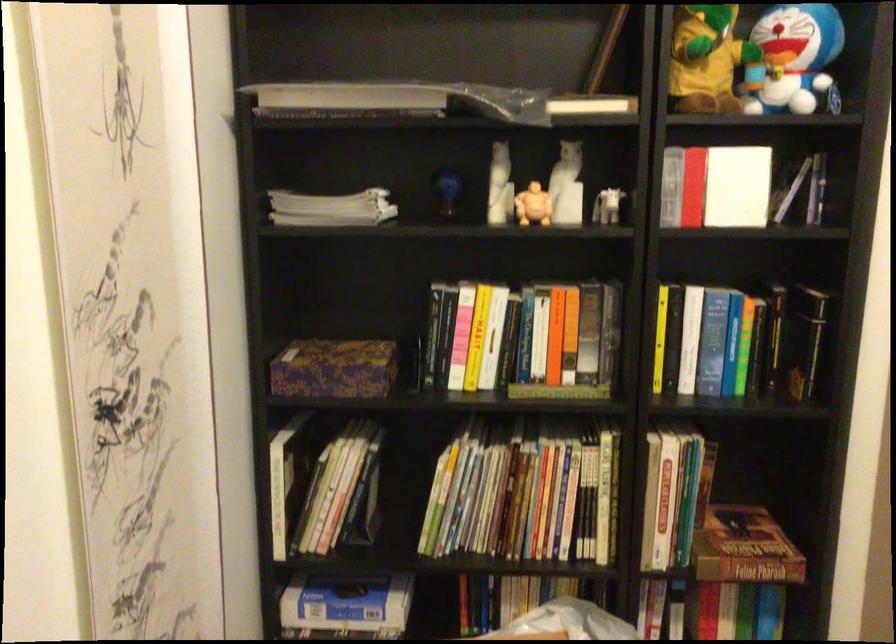
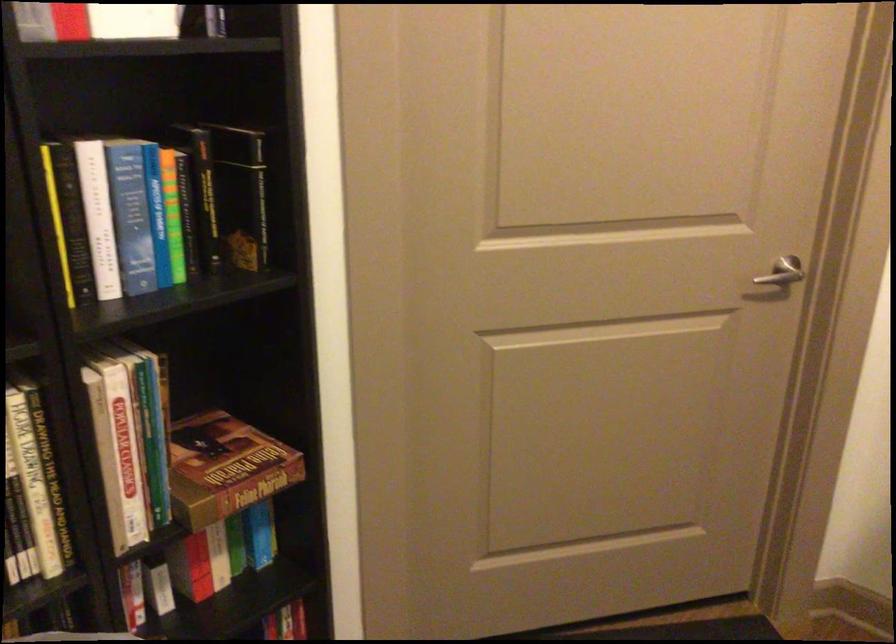
The point at (694, 332) is marked in the first image. Where is the corresponding point in the second image?

(98, 216)